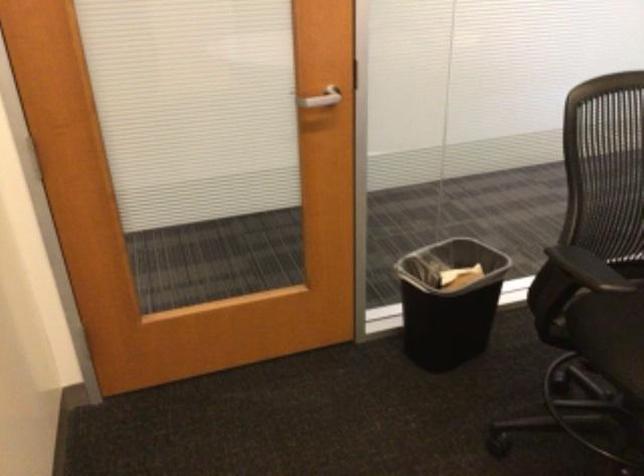
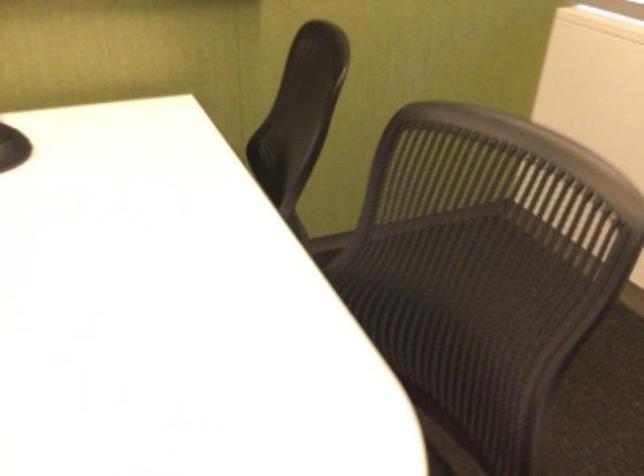
How did the camera likely rotate?

The camera rotated toward right-down.